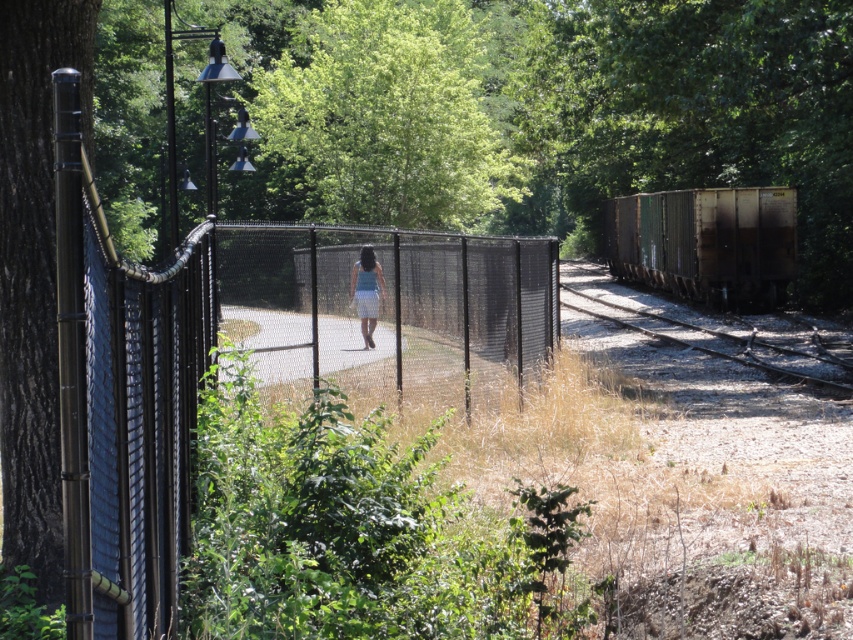
Is rusty metal train track at right above light blue denim skirt at center?

Incorrect, rusty metal train track at right is not positioned above light blue denim skirt at center.

Does point (751, 326) come in front of point (355, 288)?

No, (751, 326) is further to viewer.

What do you see at coordinates (715, 332) in the screenshot? I see `rusty metal train track at right` at bounding box center [715, 332].

Where is `rusty metal train track at right`? Image resolution: width=853 pixels, height=640 pixels. rusty metal train track at right is located at coordinates (715, 332).

Is the position of smooth brown tree trunk at left less distant than that of smooth concrete path at center?

Yes, it is in front of smooth concrete path at center.

Between smooth brown tree trunk at left and smooth concrete path at center, which one is positioned lower?

smooth concrete path at center is below.

This screenshot has height=640, width=853. I want to click on smooth brown tree trunk at left, so [33, 273].

Identify the location of smooth brown tree trunk at left. This screenshot has height=640, width=853. (33, 273).

Is rusty metal train track at right above smooth concrete path at center?

Yes.

This screenshot has width=853, height=640. I want to click on rusty metal train track at right, so click(x=715, y=332).